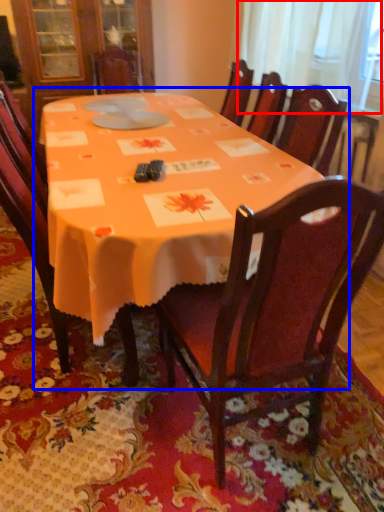
Question: Which object is closer to the camera taking this photo, curtain (highlighted by a red box) or table (highlighted by a blue box)?

Choices:
 (A) curtain
 (B) table

Answer: (B)